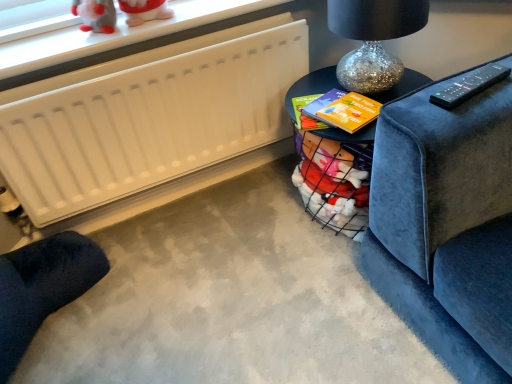
Locate an element on the screen. vacant space underneath dark blue fabric footrest at lower left (from a real-world perspective) is located at coordinates (53, 336).